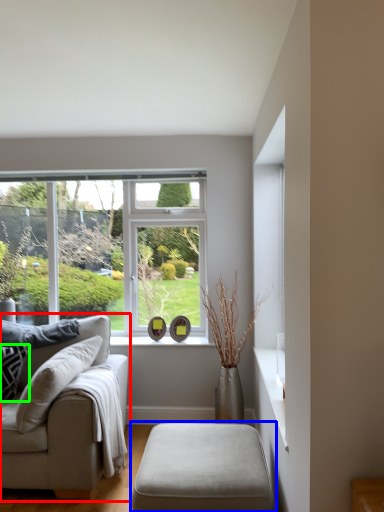
Question: Which object is the closest to the studio couch (highlighted by a red box)? Choose among these: table (highlighted by a blue box) or pillow (highlighted by a green box).

Choices:
 (A) table
 (B) pillow

Answer: (B)